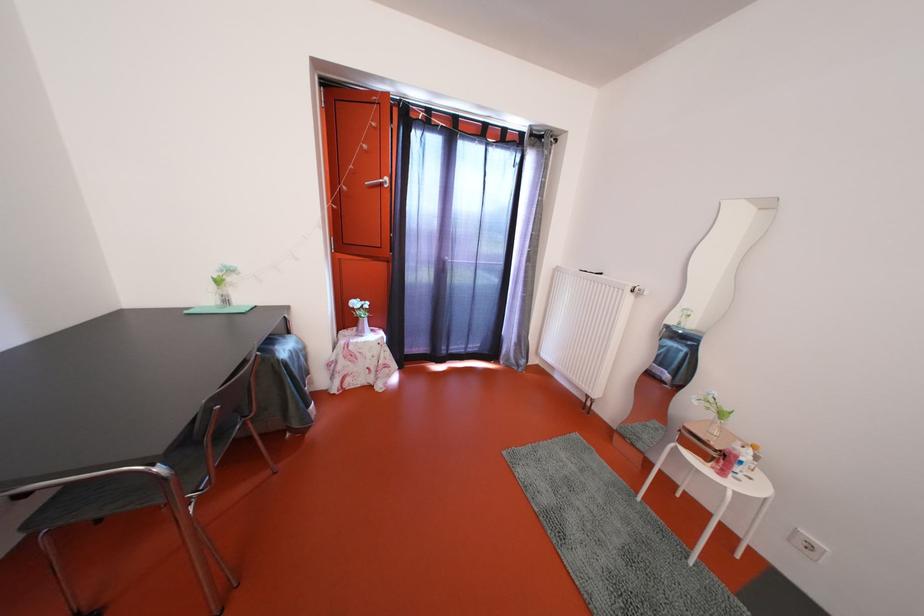
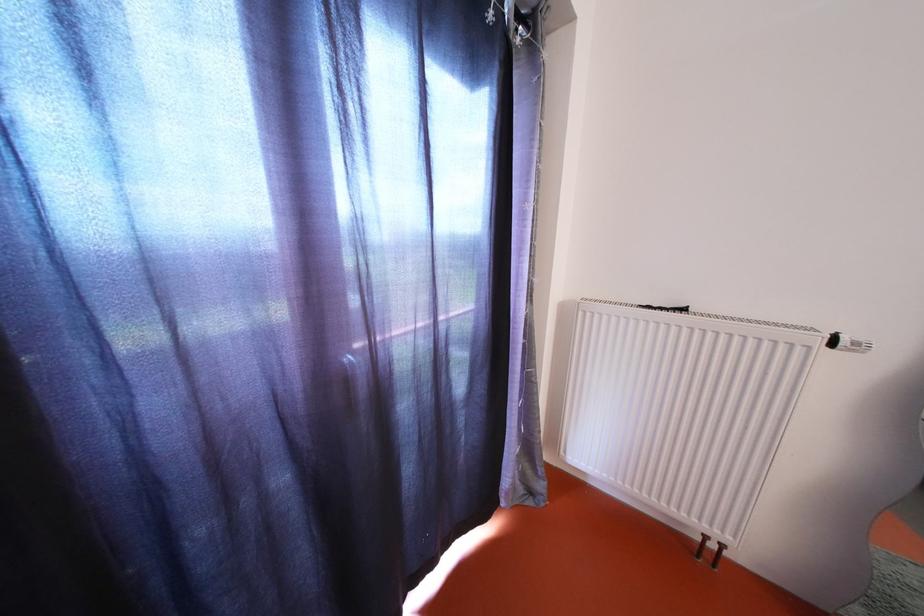
Where in the second image is the point corresponding to (x=647, y=294) from the first image?

(862, 349)